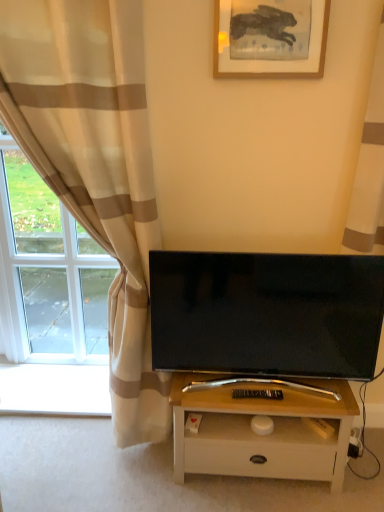
Locate an element on the screen. The height and width of the screenshot is (512, 384). unoccupied space behind black plastic remote control at center is located at coordinates (249, 386).